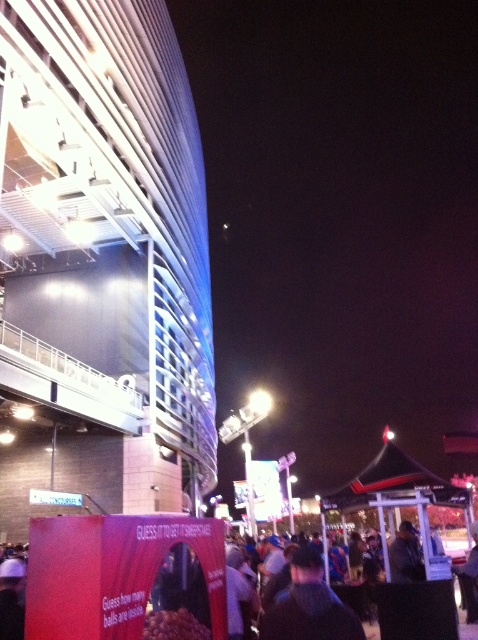
Does dark blue fabric jacket at center come behind black matte canopy at center?

That is False.

Does point (325, 600) come in front of point (390, 467)?

Yes, point (325, 600) is in front of point (390, 467).

Find the location of `dark blue fabric jacket at center`. dark blue fabric jacket at center is located at coordinates (308, 605).

Measure the distance from dark blue fabric jacket at center to shiny metallic balls at center.

dark blue fabric jacket at center is 14.67 feet from shiny metallic balls at center.

Which is more to the right, dark blue fabric jacket at center or shiny metallic balls at center?

From the viewer's perspective, dark blue fabric jacket at center appears more on the right side.

Between point (315, 609) and point (165, 627), which one is positioned behind?

The point (315, 609) is behind.

At what (x,y) coordinates should I click in order to perform the action: click on dark blue fabric jacket at center. Please return your answer as a coordinate pair (x, y). Looking at the image, I should click on (308, 605).

Is black matte canopy at center below dark brown leather jacket at center?

Yes, black matte canopy at center is below dark brown leather jacket at center.

Is black matte canopy at center thinner than dark brown leather jacket at center?

No, black matte canopy at center is not thinner than dark brown leather jacket at center.

Where is `black matte canopy at center`? black matte canopy at center is located at coordinates (393, 483).